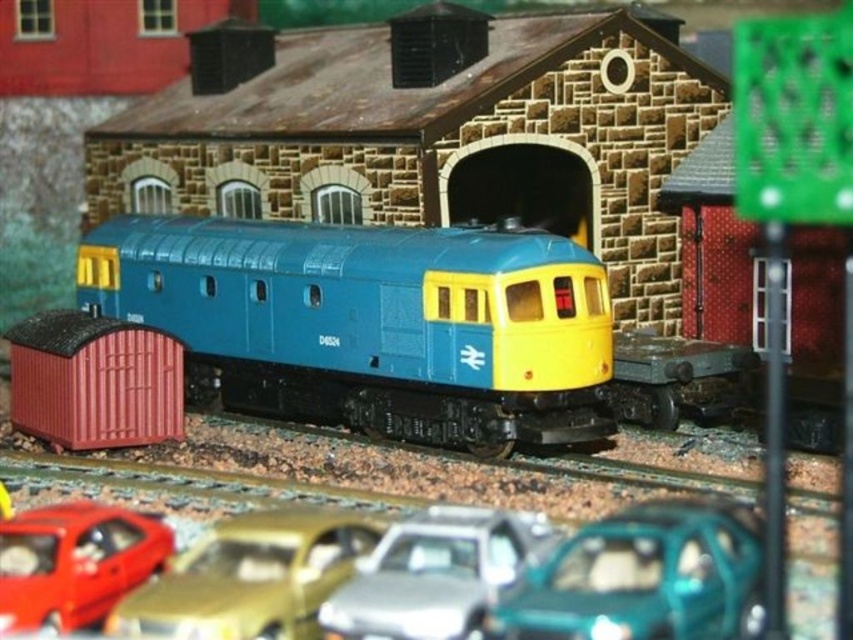
Who is taller, teal glossy car at lower center or matte plastic container at lower left?

matte plastic container at lower left

Does teal glossy car at lower center appear under matte plastic container at lower left?

Indeed, teal glossy car at lower center is positioned under matte plastic container at lower left.

Between point (613, 609) and point (165, 388), which one is positioned in front?

Positioned in front is point (613, 609).

Find the location of `teal glossy car at lower center`. teal glossy car at lower center is located at coordinates (641, 577).

Who is positioned more to the left, teal glossy car at lower center or metallic silver car at center?

From the viewer's perspective, metallic silver car at center appears more on the left side.

The width and height of the screenshot is (853, 640). What do you see at coordinates (641, 577) in the screenshot?
I see `teal glossy car at lower center` at bounding box center [641, 577].

At what (x,y) coordinates should I click in order to perform the action: click on teal glossy car at lower center. Please return your answer as a coordinate pair (x, y). The height and width of the screenshot is (640, 853). Looking at the image, I should click on (641, 577).

Can you confirm if gold metallic car at lower center is shorter than metallic silver car at center?

Yes, gold metallic car at lower center is shorter than metallic silver car at center.

Can you confirm if gold metallic car at lower center is wider than metallic silver car at center?

Correct, the width of gold metallic car at lower center exceeds that of metallic silver car at center.

Locate an element on the screen. The height and width of the screenshot is (640, 853). gold metallic car at lower center is located at coordinates (250, 577).